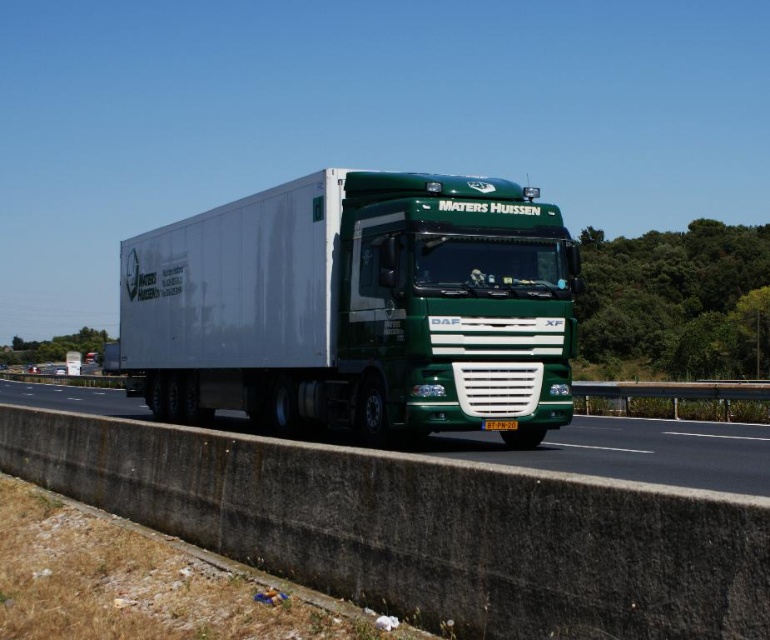
Question: Can you confirm if green matte trailer truck at center is thinner than green matte truck at center?

Choices:
 (A) no
 (B) yes

Answer: (B)

Question: Is green matte trailer truck at center below green matte truck at center?

Choices:
 (A) yes
 (B) no

Answer: (B)

Question: Does green matte trailer truck at center appear on the left side of green matte truck at center?

Choices:
 (A) no
 (B) yes

Answer: (B)

Question: Which of the following is the farthest from the observer?

Choices:
 (A) green matte truck at center
 (B) green matte trailer truck at center

Answer: (B)

Question: Which point is farther to the camera?

Choices:
 (A) (129, 362)
 (B) (28, 385)

Answer: (B)